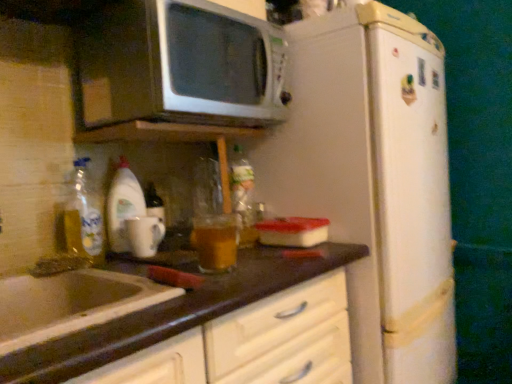
The height and width of the screenshot is (384, 512). Identify the location of vacant area that is situated to the right of white glossy mug at left. (188, 249).